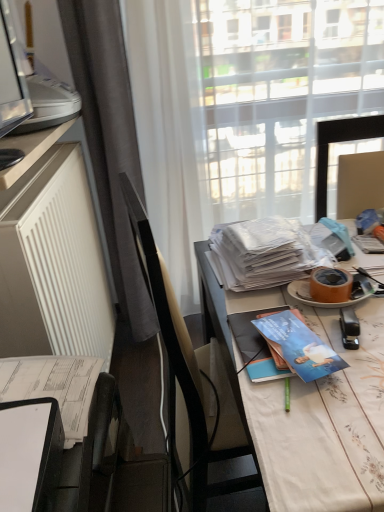
Locate an element on the screen. The height and width of the screenshot is (512, 384). vacant area situated to the left side of matte brown adhesive tape at right is located at coordinates (253, 298).